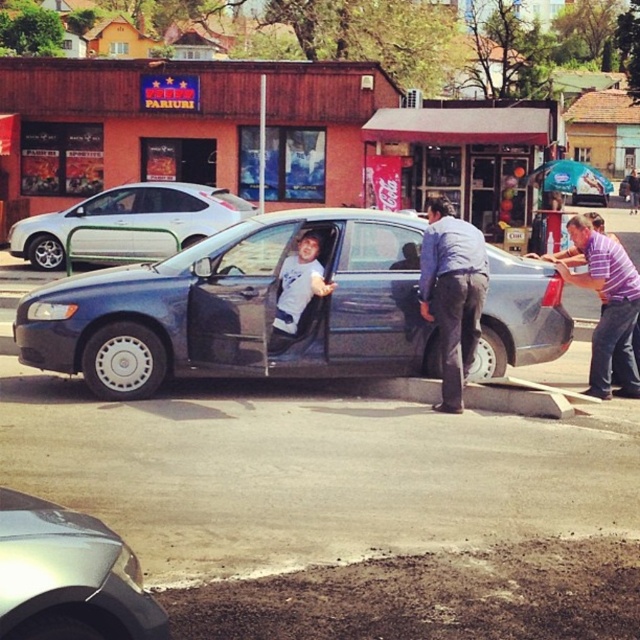
Question: Can you confirm if blue fabric shirt at center is positioned to the left of white matte shirt at center?

Choices:
 (A) no
 (B) yes

Answer: (A)

Question: Which point is farther to the camera?

Choices:
 (A) white matte shirt at center
 (B) purple striped shirt at right
 (C) metallic blue sedan at center
 (D) white matte sedan at center

Answer: (D)

Question: Which point appears closest to the camera in this image?

Choices:
 (A) (268, 324)
 (B) (88, 529)
 (C) (93, 240)

Answer: (B)

Question: Is silver metallic car at lower left further to the viewer compared to white matte sedan at center?

Choices:
 (A) yes
 (B) no

Answer: (B)

Question: Among these objects, which one is farthest from the camera?

Choices:
 (A) metallic blue sedan at center
 (B) silver metallic car at lower left
 (C) white matte sedan at center

Answer: (C)

Question: Can you confirm if purple striped shirt at right is bigger than white matte shirt at center?

Choices:
 (A) yes
 (B) no

Answer: (A)